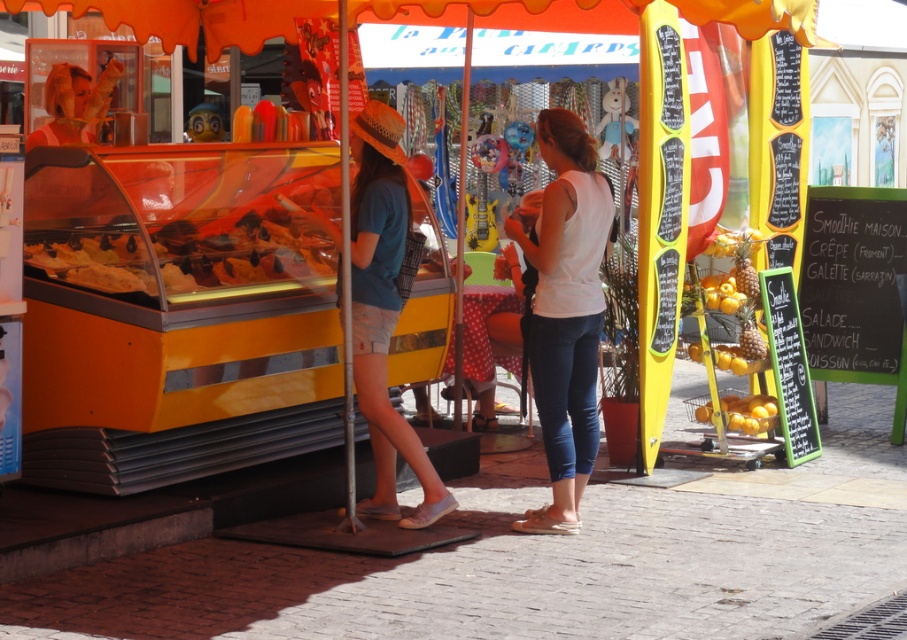
You are trying to decide what to wear for a casual day out. You have a white matte tank top at center and denim shorts at center. Which item is more suitable for layering under a jacket?

The white matte tank top at center is thinner than denim shorts at center, so it is more suitable for layering under a jacket since it can be easily worn underneath without bulk.

Please describe the exact location of the white matte tank top at center in the image using coordinates.

The white matte tank top at center is located at coordinates point [564,310].